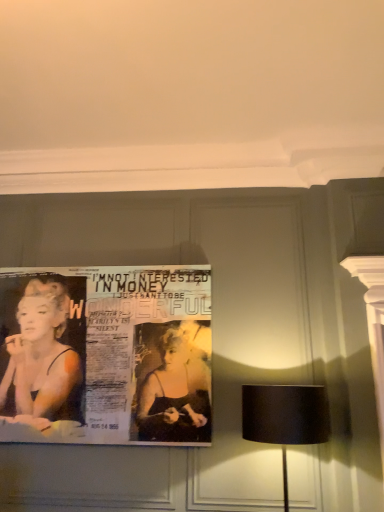
Question: Considering the relative positions of matte paper poster at left and black fabric lampshade at right in the image provided, is matte paper poster at left in front of black fabric lampshade at right?

Choices:
 (A) yes
 (B) no

Answer: (B)

Question: Is the surface of matte paper poster at left in direct contact with black fabric lampshade at right?

Choices:
 (A) no
 (B) yes

Answer: (A)

Question: From the image's perspective, would you say matte paper poster at left is shown under black fabric lampshade at right?

Choices:
 (A) yes
 (B) no

Answer: (B)

Question: Is the position of matte paper poster at left more distant than that of black fabric lampshade at right?

Choices:
 (A) no
 (B) yes

Answer: (B)

Question: Does matte paper poster at left appear on the left side of black fabric lampshade at right?

Choices:
 (A) yes
 (B) no

Answer: (A)

Question: Does matte paper poster at left have a lesser width compared to black fabric lampshade at right?

Choices:
 (A) yes
 (B) no

Answer: (A)

Question: Is black fabric lampshade at right looking in the opposite direction of matte paper poster at left?

Choices:
 (A) yes
 (B) no

Answer: (B)

Question: Is black fabric lampshade at right facing towards matte paper poster at left?

Choices:
 (A) no
 (B) yes

Answer: (A)

Question: Is black fabric lampshade at right at the right side of matte paper poster at left?

Choices:
 (A) no
 (B) yes

Answer: (B)

Question: Considering the relative positions of black fabric lampshade at right and matte paper poster at left in the image provided, is black fabric lampshade at right to the left of matte paper poster at left from the viewer's perspective?

Choices:
 (A) yes
 (B) no

Answer: (B)

Question: Is black fabric lampshade at right smaller than matte paper poster at left?

Choices:
 (A) yes
 (B) no

Answer: (B)

Question: Is black fabric lampshade at right positioned beyond the bounds of matte paper poster at left?

Choices:
 (A) no
 (B) yes

Answer: (B)

Question: Considering the relative positions of matte paper poster at left and black fabric lampshade at right in the image provided, is matte paper poster at left to the left or to the right of black fabric lampshade at right?

Choices:
 (A) right
 (B) left

Answer: (B)